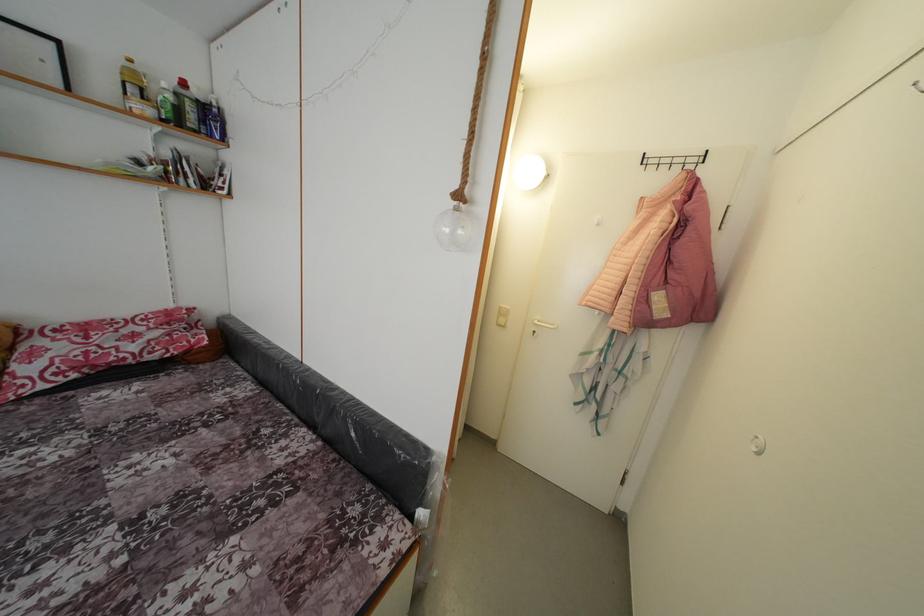
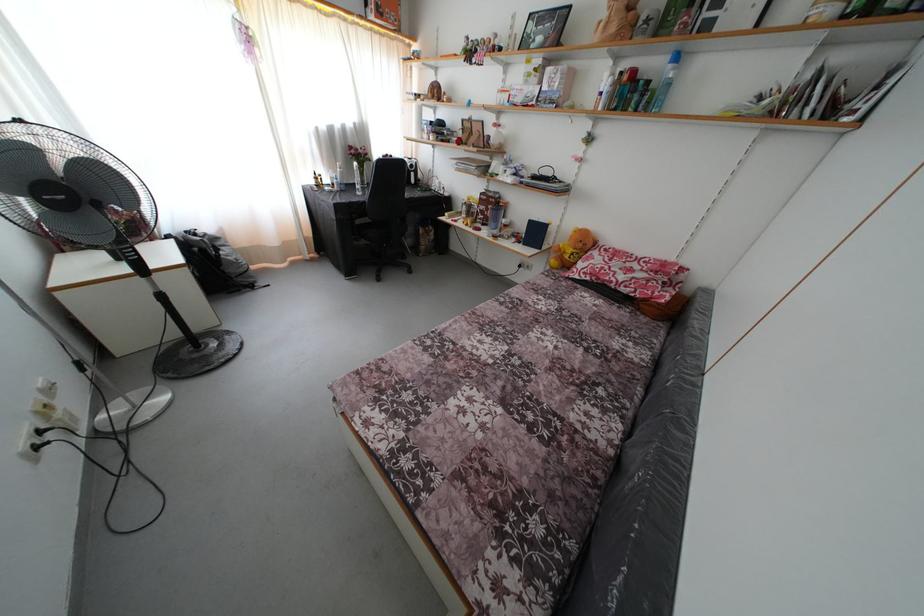
In the second image, find the point that corresponds to point 251,381 in the first image.

(663, 353)